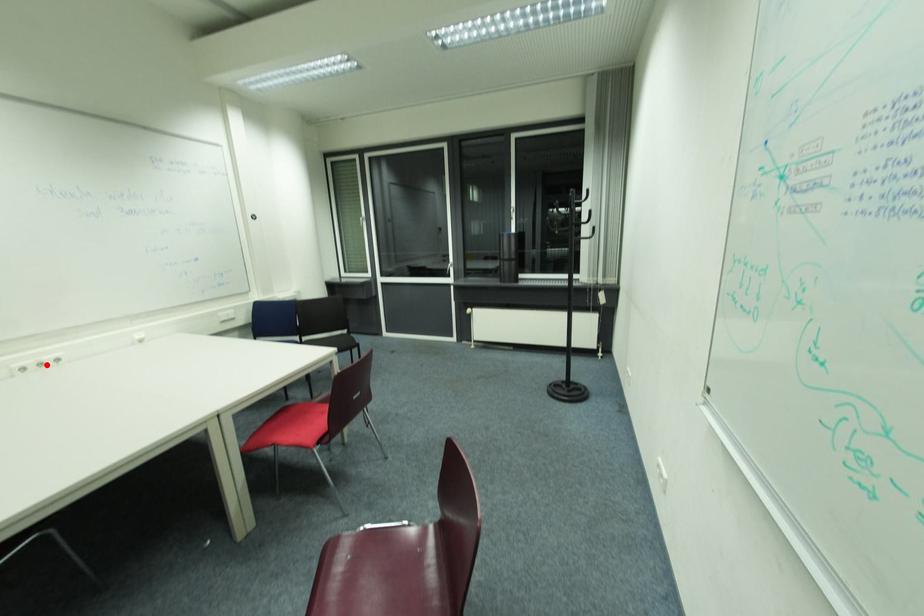
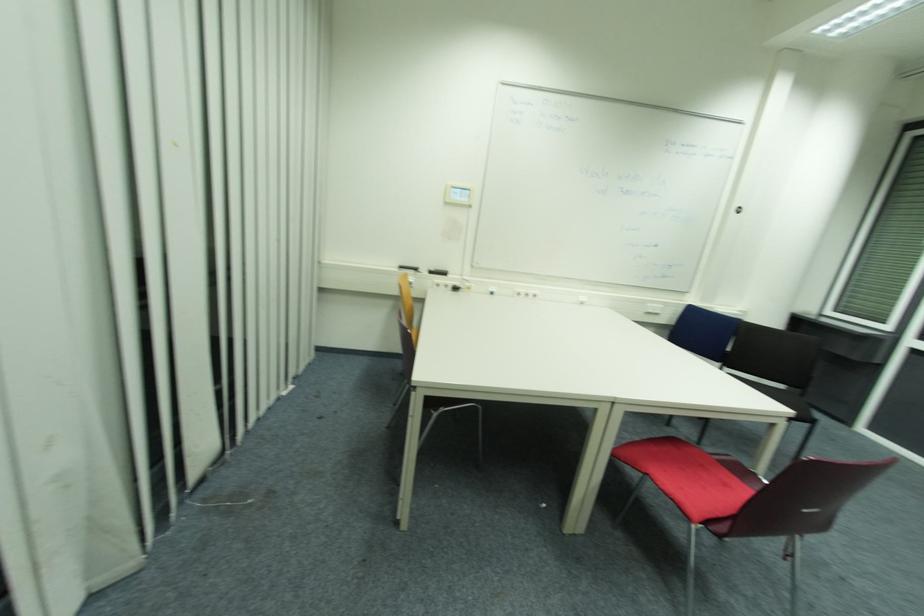
Where in the second image is the point corresponding to the highlighted location from the first image?

(529, 294)